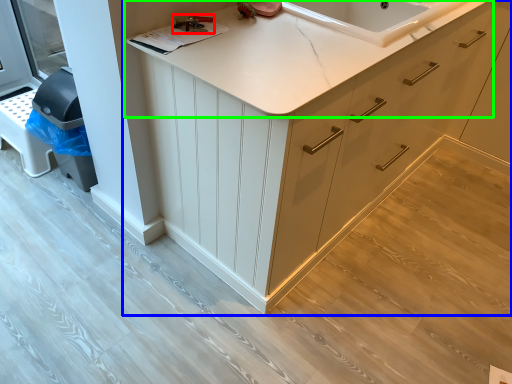
Question: Estimate the real-world distances between objects in this image. Which object is farther from tool (highlighted by a red box), cabinetry (highlighted by a blue box) or countertop (highlighted by a green box)?

Choices:
 (A) cabinetry
 (B) countertop

Answer: (A)